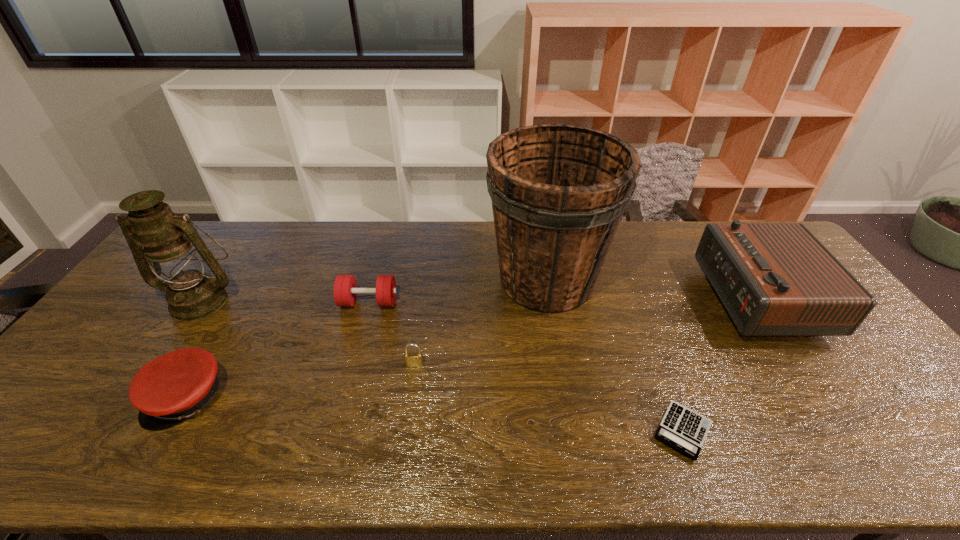
Where is `object that is positioned at the near edge`? object that is positioned at the near edge is located at coordinates 681,428.

Identify the location of object at the left edge. The width and height of the screenshot is (960, 540). (172, 245).

Locate an element on the screen. object that is positioned at the right edge is located at coordinates (774, 279).

This screenshot has width=960, height=540. I want to click on object present at the far right corner, so click(x=774, y=279).

This screenshot has width=960, height=540. I want to click on free spot at the far edge of the desktop, so click(316, 240).

Locate an element on the screen. vacant space at the near edge is located at coordinates (750, 469).

At what (x,y) coordinates should I click in order to perform the action: click on vacant space at the left edge. Please return your answer as a coordinate pair (x, y). Looking at the image, I should click on (116, 362).

I want to click on vacant space at the right edge, so click(836, 377).

Locate an element on the screen. Image resolution: width=960 pixels, height=540 pixels. vacant space at the near left corner is located at coordinates (16, 467).

Image resolution: width=960 pixels, height=540 pixels. Find the location of `vacant area at the near right corner of the desktop`. vacant area at the near right corner of the desktop is located at coordinates (916, 439).